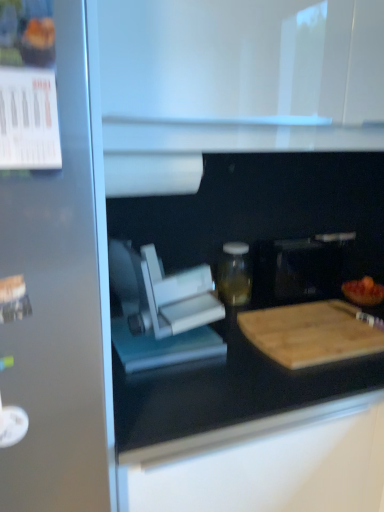
Question: Based on their sizes in the image, would you say white plastic food processor at center, which appears as the second appliance when viewed from the back, is bigger or smaller than wooden cutting board at lower right?

Choices:
 (A) big
 (B) small

Answer: (A)

Question: In the image, is white plastic food processor at center, the first appliance when ordered from front to back, positioned in front of or behind wooden cutting board at lower right?

Choices:
 (A) front
 (B) behind

Answer: (A)

Question: Estimate the real-world distances between objects in this image. Which object is closer to the wooden cutting board at right?

Choices:
 (A) white matte paper towel at upper center
 (B) wooden cutting board at lower right
 (C) black matte microwave at center, which is counted as the 1th appliance, starting from the right
 (D) white plastic food processor at center, the 1th appliance viewed from the left
 (E) transparent glass jar at center

Answer: (C)

Question: Which object is the closest to the black matte microwave at center, the 2th appliance from the front?

Choices:
 (A) white matte paper towel at upper center
 (B) wooden cutting board at lower right
 (C) white plastic food processor at center, the 1th appliance viewed from the left
 (D) wooden cutting board at right
 (E) transparent glass jar at center

Answer: (E)